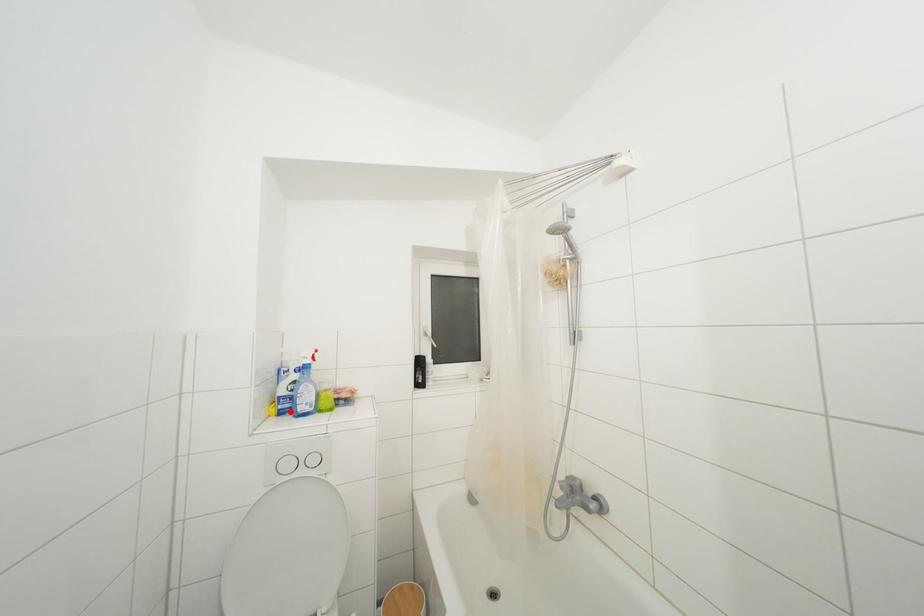
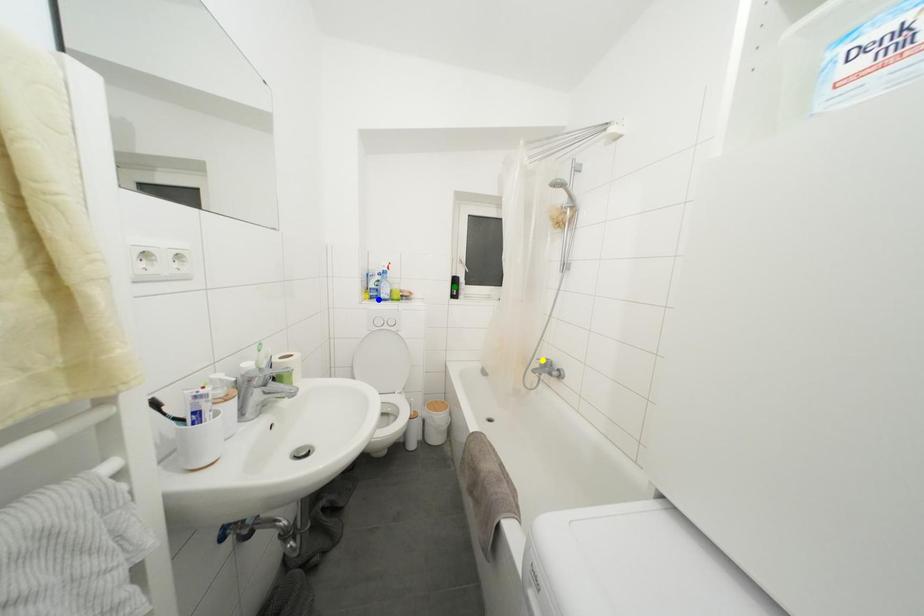
Question: I am providing you with two images of the same scene from different viewpoints. A red point is marked on the first image. You are given multiple points on the second image. Which point in image 2 represents the same 3d spot as the red point in image 1?

Choices:
 (A) green point
 (B) yellow point
 (C) blue point

Answer: (C)